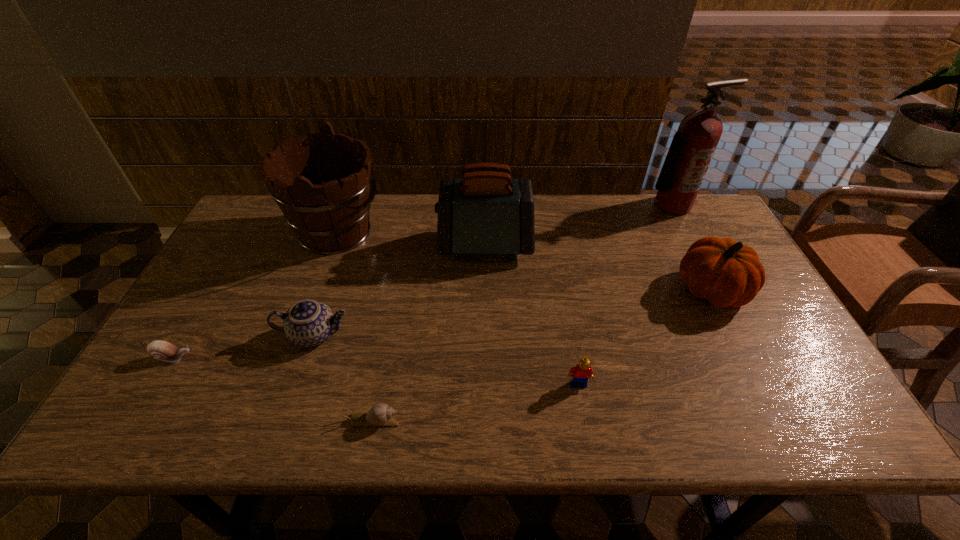
You are a GUI agent. You are given a task and a screenshot of the screen. Output one action in this format:
    pyautogui.click(x=<x>, y=<y>)
    Task: Click on the vacant area situated on the shell of the shorter escargot
    This screenshot has height=540, width=960.
    Given the screenshot: What is the action you would take?
    pyautogui.click(x=561, y=420)

Where is `fire extinguisher located in the far edge section of the desktop`? fire extinguisher located in the far edge section of the desktop is located at coordinates pyautogui.click(x=692, y=148).

Where is `wine bucket located at the far edge`? wine bucket located at the far edge is located at coordinates (332, 217).

Identify the location of toaster at the far edge. (486, 212).

Find the location of a particular element. This screenshot has width=960, height=540. object located at the near edge is located at coordinates (380, 414).

I want to click on object that is at the left edge, so click(162, 350).

Identify the location of fire extinguisher that is at the right edge. This screenshot has width=960, height=540. (692, 148).

Where is `pumpkin that is at the right edge`? This screenshot has width=960, height=540. pumpkin that is at the right edge is located at coordinates (726, 273).

At what (x,y) coordinates should I click in order to perform the action: click on object positioned at the far right corner. Please return your answer as a coordinate pair (x, y). This screenshot has width=960, height=540. Looking at the image, I should click on (692, 148).

In the image, there is a desktop. Where is `free region at the far edge`? Image resolution: width=960 pixels, height=540 pixels. free region at the far edge is located at coordinates (426, 212).